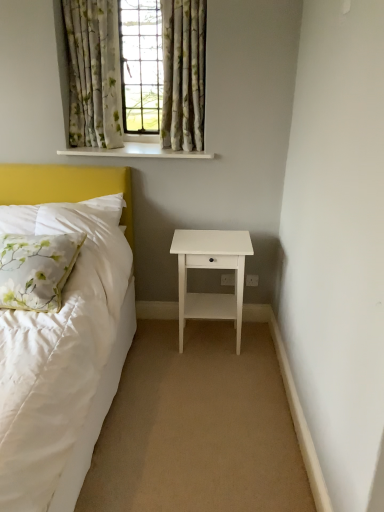
This screenshot has width=384, height=512. What do you see at coordinates (183, 74) in the screenshot?
I see `floral fabric curtains at upper center, which appears as the 1th curtain when viewed from the right` at bounding box center [183, 74].

At what (x,y) coordinates should I click in order to perform the action: click on white glossy window sill at upper center. Please return your answer as a coordinate pair (x, y). Looking at the image, I should click on (136, 152).

What is the approximate width of beige carpet at lower center?

5.75 feet.

The height and width of the screenshot is (512, 384). In order to click on floral fabric curtains at upper center, which appears as the 1th curtain when viewed from the right in this screenshot , I will do `click(183, 74)`.

Is floral fabric curtains at upper center, the 1th curtain in the left-to-right sequence, far from floral fabric curtains at upper center, which ranks as the second curtain in left-to-right order?

No, floral fabric curtains at upper center, the 1th curtain in the left-to-right sequence, is not far away from floral fabric curtains at upper center, which ranks as the second curtain in left-to-right order.

From a real-world perspective, is floral fabric curtains at upper center, the 1th curtain in the left-to-right sequence, located beneath floral fabric curtains at upper center, which ranks as the second curtain in left-to-right order?

Yes, from a real-world perspective, floral fabric curtains at upper center, the 1th curtain in the left-to-right sequence, is under floral fabric curtains at upper center, which ranks as the second curtain in left-to-right order.

From the picture: Which is in front, floral fabric curtains at upper center, which is counted as the 2th curtain, starting from the right, or floral fabric curtains at upper center, which ranks as the second curtain in left-to-right order?

floral fabric curtains at upper center, which ranks as the second curtain in left-to-right order.

Which is correct: floral fabric curtains at upper center, which is counted as the 2th curtain, starting from the right, is inside floral fabric curtains at upper center, which appears as the 1th curtain when viewed from the right, or outside of it?

floral fabric curtains at upper center, which is counted as the 2th curtain, starting from the right, is located beyond the bounds of floral fabric curtains at upper center, which appears as the 1th curtain when viewed from the right.

Would you say white floral fabric pillow at left contains floral fabric curtains at upper center, which ranks as the second curtain in left-to-right order?

That's incorrect, floral fabric curtains at upper center, which ranks as the second curtain in left-to-right order, is not inside white floral fabric pillow at left.

From the image's perspective, which one is positioned lower, white floral fabric pillow at left or floral fabric curtains at upper center, which appears as the 1th curtain when viewed from the right?

white floral fabric pillow at left.

Considering the relative sizes of white floral fabric pillow at left and floral fabric curtains at upper center, which appears as the 1th curtain when viewed from the right, in the image provided, is white floral fabric pillow at left taller than floral fabric curtains at upper center, which appears as the 1th curtain when viewed from the right,?

In fact, white floral fabric pillow at left may be shorter than floral fabric curtains at upper center, which appears as the 1th curtain when viewed from the right.

Looking at the image, does white floral fabric pillow at left seem bigger or smaller compared to floral fabric curtains at upper center, which appears as the 1th curtain when viewed from the right?

Considering their sizes, white floral fabric pillow at left takes up more space than floral fabric curtains at upper center, which appears as the 1th curtain when viewed from the right.

Is beige carpet at lower center placed right next to white glossy nightstand at lower right?

No, beige carpet at lower center is not making contact with white glossy nightstand at lower right.

Between beige carpet at lower center and white glossy nightstand at lower right, which one has smaller size?

beige carpet at lower center is smaller.

How many degrees apart are the facing directions of beige carpet at lower center and white glossy nightstand at lower right?

The facing directions of beige carpet at lower center and white glossy nightstand at lower right are 89.8 degrees apart.

From the image's perspective, who appears lower, beige carpet at lower center or white glossy nightstand at lower right?

beige carpet at lower center, from the image's perspective.

From a real-world perspective, who is located higher, white glossy nightstand at lower right or floral fabric curtains at upper center, which is counted as the 2th curtain, starting from the right?

In real-world perspective, floral fabric curtains at upper center, which is counted as the 2th curtain, starting from the right, is above.

Is white glossy nightstand at lower right facing away from floral fabric curtains at upper center, the 1th curtain in the left-to-right sequence?

No.

Consider the image. Is white glossy nightstand at lower right located outside floral fabric curtains at upper center, the 1th curtain in the left-to-right sequence?

Yes, white glossy nightstand at lower right is located beyond the bounds of floral fabric curtains at upper center, the 1th curtain in the left-to-right sequence.

Can you tell me how much white glossy nightstand at lower right and floral fabric curtains at upper center, which is counted as the 2th curtain, starting from the right, differ in facing direction?

The angular difference between white glossy nightstand at lower right and floral fabric curtains at upper center, which is counted as the 2th curtain, starting from the right, is 0.341 degrees.

Is floral fabric curtains at upper center, the 1th curtain in the left-to-right sequence, oriented away from white floral fabric pillow at left?

That's not correct — floral fabric curtains at upper center, the 1th curtain in the left-to-right sequence, is not looking away from white floral fabric pillow at left.

Which point is more distant from viewer, (x=110, y=139) or (x=66, y=251)?

The point (x=110, y=139) is behind.

Which of these two, floral fabric curtains at upper center, the 1th curtain in the left-to-right sequence, or white floral fabric pillow at left, is smaller?

floral fabric curtains at upper center, the 1th curtain in the left-to-right sequence, is smaller.

Considering the sizes of floral fabric curtains at upper center, the 1th curtain in the left-to-right sequence, and white floral fabric pillow at left in the image, is floral fabric curtains at upper center, the 1th curtain in the left-to-right sequence, wider or thinner than white floral fabric pillow at left?

In the image, floral fabric curtains at upper center, the 1th curtain in the left-to-right sequence, appears to be more narrow than white floral fabric pillow at left.

From the image's perspective, does white glossy window sill at upper center appear higher than floral fabric curtains at upper center, which is counted as the 2th curtain, starting from the right?

Incorrect, from the image's perspective, white glossy window sill at upper center is lower than floral fabric curtains at upper center, which is counted as the 2th curtain, starting from the right.

Is white glossy window sill at upper center at the left side of floral fabric curtains at upper center, the 1th curtain in the left-to-right sequence?

Incorrect, white glossy window sill at upper center is not on the left side of floral fabric curtains at upper center, the 1th curtain in the left-to-right sequence.

At what (x,y) coordinates should I click in order to perform the action: click on window sill on the right of floral fabric curtains at upper center, which is counted as the 2th curtain, starting from the right. Please return your answer as a coordinate pair (x, y). The image size is (384, 512). Looking at the image, I should click on (136, 152).

Is white glossy window sill at upper center closer to camera compared to floral fabric curtains at upper center, which appears as the 1th curtain when viewed from the right?

That is False.

Considering the sizes of objects white glossy window sill at upper center and floral fabric curtains at upper center, which appears as the 1th curtain when viewed from the right, in the image provided, who is bigger, white glossy window sill at upper center or floral fabric curtains at upper center, which appears as the 1th curtain when viewed from the right,?

floral fabric curtains at upper center, which appears as the 1th curtain when viewed from the right.

Is white glossy window sill at upper center inside or outside of floral fabric curtains at upper center, which appears as the 1th curtain when viewed from the right?

white glossy window sill at upper center is located beyond the bounds of floral fabric curtains at upper center, which appears as the 1th curtain when viewed from the right.

This screenshot has width=384, height=512. I want to click on curtain in front of the floral fabric curtains at upper center, the 1th curtain in the left-to-right sequence, so pyautogui.click(x=183, y=74).

You are a GUI agent. You are given a task and a screenshot of the screen. Output one action in this format:
    pyautogui.click(x=<x>, y=<y>)
    Task: Click on the curtain that is the 2nd object above the white floral fabric pillow at left (from a real-world perspective)
    
    Given the screenshot: What is the action you would take?
    pyautogui.click(x=183, y=74)

Looking at the image, which one is located closer to white glossy nightstand at lower right, white floral fabric pillow at left or floral fabric curtains at upper center, which appears as the 1th curtain when viewed from the right?

Based on the image, white floral fabric pillow at left appears to be nearer to white glossy nightstand at lower right.

From the picture: Which object lies further to the anchor point floral fabric curtain at upper center, floral fabric curtains at upper center, which is counted as the 2th curtain, starting from the right, or white glossy nightstand at lower right?

white glossy nightstand at lower right.

Based on their spatial positions, is white glossy window sill at upper center or floral fabric curtain at upper center closer to white floral fabric pillow at left?

white glossy window sill at upper center lies closer to white floral fabric pillow at left than the other object.

Which object lies nearer to the anchor point floral fabric curtains at upper center, which appears as the 1th curtain when viewed from the right, white glossy window sill at upper center or white glossy nightstand at lower right?

white glossy window sill at upper center is positioned closer to the anchor floral fabric curtains at upper center, which appears as the 1th curtain when viewed from the right.

Looking at the image, which one is located closer to floral fabric curtain at upper center, floral fabric curtains at upper center, which is counted as the 2th curtain, starting from the right, or floral fabric curtains at upper center, which ranks as the second curtain in left-to-right order?

Among the two, floral fabric curtains at upper center, which is counted as the 2th curtain, starting from the right, is located nearer to floral fabric curtain at upper center.

Which object lies nearer to the anchor point floral fabric curtains at upper center, which appears as the 1th curtain when viewed from the right, white glossy window sill at upper center or floral fabric curtains at upper center, the 1th curtain in the left-to-right sequence?

white glossy window sill at upper center lies closer to floral fabric curtains at upper center, which appears as the 1th curtain when viewed from the right, than the other object.

Looking at the image, which one is located further to beige carpet at lower center, white glossy window sill at upper center or floral fabric curtains at upper center, the 1th curtain in the left-to-right sequence?

floral fabric curtains at upper center, the 1th curtain in the left-to-right sequence, is further to beige carpet at lower center.

When comparing their distances from beige carpet at lower center, does white floral fabric pillow at left or floral fabric curtains at upper center, which is counted as the 2th curtain, starting from the right, seem closer?

Among the two, white floral fabric pillow at left is located nearer to beige carpet at lower center.

The height and width of the screenshot is (512, 384). What are the coordinates of `curtain between floral fabric curtains at upper center, the 1th curtain in the left-to-right sequence, and white glossy nightstand at lower right in the up-down direction` in the screenshot? It's located at (183, 74).

Where is `window sill between floral fabric curtains at upper center, which is counted as the 2th curtain, starting from the right, and floral fabric curtains at upper center, which appears as the 1th curtain when viewed from the right, in the horizontal direction`? The width and height of the screenshot is (384, 512). window sill between floral fabric curtains at upper center, which is counted as the 2th curtain, starting from the right, and floral fabric curtains at upper center, which appears as the 1th curtain when viewed from the right, in the horizontal direction is located at coordinates (136, 152).

You are a GUI agent. You are given a task and a screenshot of the screen. Output one action in this format:
    pyautogui.click(x=<x>, y=<y>)
    Task: Click on the nightstand between floral fabric curtains at upper center, which ranks as the second curtain in left-to-right order, and beige carpet at lower center in the up-down direction
    This screenshot has height=512, width=384.
    Given the screenshot: What is the action you would take?
    pyautogui.click(x=211, y=268)

What are the coordinates of `window sill between floral fabric curtain at upper center and white glossy nightstand at lower right from top to bottom` in the screenshot? It's located at (136, 152).